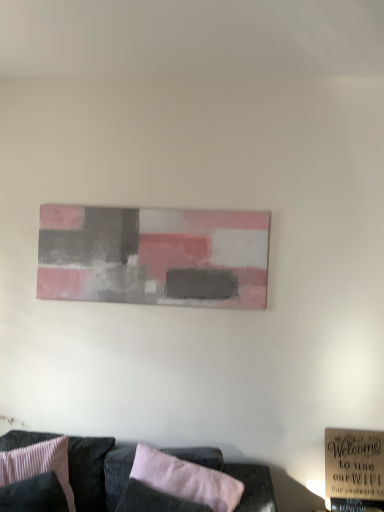
The image size is (384, 512). What do you see at coordinates (186, 479) in the screenshot? I see `pink fabric pillow at lower center, the 1th pillow viewed from the right` at bounding box center [186, 479].

What do you see at coordinates (354, 464) in the screenshot?
I see `wooden sign at lower right` at bounding box center [354, 464].

This screenshot has width=384, height=512. What are the coordinates of `pink ribbed fabric pillow at lower left, the 1th pillow when ordered from left to right` in the screenshot? It's located at (38, 464).

At what (x,y) coordinates should I click in order to perform the action: click on velvet black couch at lower center. Please return your answer as a coordinate pair (x, y). Looking at the image, I should click on (98, 472).

Locate an element on the screen. matte acrylic painting at center is located at coordinates (154, 256).

At what (x,y) coordinates should I click in order to perform the action: click on pink fabric pillow at lower center, the second pillow positioned from the left. Please return your answer as a coordinate pair (x, y). Image resolution: width=384 pixels, height=512 pixels. Looking at the image, I should click on (186, 479).

Is matte acrylic painting at center positioned far away from pink ribbed fabric pillow at lower left, the 1th pillow when ordered from left to right?

No, there isn't a large distance between matte acrylic painting at center and pink ribbed fabric pillow at lower left, the 1th pillow when ordered from left to right.

From a real-world perspective, relative to pink ribbed fabric pillow at lower left, the 1th pillow when ordered from left to right, is matte acrylic painting at center vertically above or below?

matte acrylic painting at center is above pink ribbed fabric pillow at lower left, the 1th pillow when ordered from left to right.

Can you confirm if matte acrylic painting at center is shorter than pink ribbed fabric pillow at lower left, the 1th pillow when ordered from left to right?

In fact, matte acrylic painting at center may be taller than pink ribbed fabric pillow at lower left, the 1th pillow when ordered from left to right.

Measure the distance from pink ribbed fabric pillow at lower left, the 1th pillow when ordered from left to right, to matte acrylic painting at center.

pink ribbed fabric pillow at lower left, the 1th pillow when ordered from left to right, and matte acrylic painting at center are 37.26 inches apart from each other.

Relative to matte acrylic painting at center, is pink ribbed fabric pillow at lower left, the 1th pillow when ordered from left to right, in front or behind?

Visually, pink ribbed fabric pillow at lower left, the 1th pillow when ordered from left to right, is located in front of matte acrylic painting at center.

Based on the photo, how many degrees apart are the facing directions of pink ribbed fabric pillow at lower left, which is counted as the second pillow, starting from the right, and matte acrylic painting at center?

They differ by 35.7 degrees in their facing directions.

In the scene shown: Would you say pink ribbed fabric pillow at lower left, which is counted as the second pillow, starting from the right, contains matte acrylic painting at center?

No, matte acrylic painting at center is not surrounded by pink ribbed fabric pillow at lower left, which is counted as the second pillow, starting from the right.

How many degrees apart are the facing directions of pink ribbed fabric pillow at lower left, the 1th pillow when ordered from left to right, and wooden sign at lower right?

pink ribbed fabric pillow at lower left, the 1th pillow when ordered from left to right, and wooden sign at lower right are facing 35.7 degrees away from each other.

Is pink ribbed fabric pillow at lower left, the 1th pillow when ordered from left to right, positioned with its back to wooden sign at lower right?

No, wooden sign at lower right is not at the back of pink ribbed fabric pillow at lower left, the 1th pillow when ordered from left to right.

Locate an element on the screen. This screenshot has height=512, width=384. plaque directly beneath the pink ribbed fabric pillow at lower left, which is counted as the second pillow, starting from the right (from a real-world perspective) is located at coordinates (354, 464).

Which of these two, pink ribbed fabric pillow at lower left, which is counted as the second pillow, starting from the right, or pink fabric pillow at lower center, the 1th pillow viewed from the right, is bigger?

→ pink ribbed fabric pillow at lower left, which is counted as the second pillow, starting from the right.

Where is `pillow below the pink fabric pillow at lower center, the second pillow positioned from the left (from a real-world perspective)`? Image resolution: width=384 pixels, height=512 pixels. pillow below the pink fabric pillow at lower center, the second pillow positioned from the left (from a real-world perspective) is located at coordinates (38, 464).

Considering their positions, is pink ribbed fabric pillow at lower left, which is counted as the second pillow, starting from the right, located in front of or behind pink fabric pillow at lower center, the 1th pillow viewed from the right?

Clearly, pink ribbed fabric pillow at lower left, which is counted as the second pillow, starting from the right, is behind pink fabric pillow at lower center, the 1th pillow viewed from the right.

Is pink ribbed fabric pillow at lower left, the 1th pillow when ordered from left to right, looking in the opposite direction of pink fabric pillow at lower center, the second pillow positioned from the left?

pink ribbed fabric pillow at lower left, the 1th pillow when ordered from left to right, is not turned away from pink fabric pillow at lower center, the second pillow positioned from the left.

Between point (347, 476) and point (160, 456), which one is positioned in front?

The point (160, 456) is closer.

Is wooden sign at lower right turned away from pink fabric pillow at lower center, the second pillow positioned from the left?

No, wooden sign at lower right is not facing away from pink fabric pillow at lower center, the second pillow positioned from the left.

From a real-world perspective, is wooden sign at lower right positioned under pink fabric pillow at lower center, the 1th pillow viewed from the right, based on gravity?

Yes.

In terms of size, does wooden sign at lower right appear bigger or smaller than pink fabric pillow at lower center, the 1th pillow viewed from the right?

In the image, wooden sign at lower right appears to be smaller than pink fabric pillow at lower center, the 1th pillow viewed from the right.

Is velvet black couch at lower center to the left of pink fabric pillow at lower center, the second pillow positioned from the left, from the viewer's perspective?

Yes, velvet black couch at lower center is to the left of pink fabric pillow at lower center, the second pillow positioned from the left.

Looking at this image, from a real-world perspective, is velvet black couch at lower center physically above pink fabric pillow at lower center, the second pillow positioned from the left?

No.

From the image's perspective, is velvet black couch at lower center located above pink fabric pillow at lower center, the 1th pillow viewed from the right?

No, from the image's perspective, velvet black couch at lower center is not over pink fabric pillow at lower center, the 1th pillow viewed from the right.

Can you confirm if velvet black couch at lower center is bigger than pink fabric pillow at lower center, the 1th pillow viewed from the right?

Indeed, velvet black couch at lower center has a larger size compared to pink fabric pillow at lower center, the 1th pillow viewed from the right.

Based on the photo, is pink fabric pillow at lower center, the 1th pillow viewed from the right, to the right of pink ribbed fabric pillow at lower left, which is counted as the second pillow, starting from the right, from the viewer's perspective?

Correct, you'll find pink fabric pillow at lower center, the 1th pillow viewed from the right, to the right of pink ribbed fabric pillow at lower left, which is counted as the second pillow, starting from the right.

Is pink fabric pillow at lower center, the 1th pillow viewed from the right, far away from pink ribbed fabric pillow at lower left, which is counted as the second pillow, starting from the right?

No.

Is pink fabric pillow at lower center, the second pillow positioned from the left, oriented away from pink ribbed fabric pillow at lower left, the 1th pillow when ordered from left to right?

No, pink ribbed fabric pillow at lower left, the 1th pillow when ordered from left to right, is not at the back of pink fabric pillow at lower center, the second pillow positioned from the left.

Considering the positions of objects pink fabric pillow at lower center, the second pillow positioned from the left, and pink ribbed fabric pillow at lower left, the 1th pillow when ordered from left to right, in the image provided, who is behind, pink fabric pillow at lower center, the second pillow positioned from the left, or pink ribbed fabric pillow at lower left, the 1th pillow when ordered from left to right,?

pink ribbed fabric pillow at lower left, the 1th pillow when ordered from left to right, is behind.

At what (x,y) coordinates should I click in order to perform the action: click on picture frame lying on the right of pink ribbed fabric pillow at lower left, which is counted as the second pillow, starting from the right. Please return your answer as a coordinate pair (x, y). Looking at the image, I should click on (154, 256).

Starting from the matte acrylic painting at center, which pillow is the 1st one in front? Please provide its 2D coordinates.

[(38, 464)]

Considering their positions, is velvet black couch at lower center positioned closer to pink ribbed fabric pillow at lower left, which is counted as the second pillow, starting from the right, than wooden sign at lower right?

velvet black couch at lower center is positioned closer to the anchor pink ribbed fabric pillow at lower left, which is counted as the second pillow, starting from the right.

Looking at this image, estimate the real-world distances between objects in this image. Which object is closer to matte acrylic painting at center, pink ribbed fabric pillow at lower left, the 1th pillow when ordered from left to right, or wooden sign at lower right?

Based on the image, pink ribbed fabric pillow at lower left, the 1th pillow when ordered from left to right, appears to be nearer to matte acrylic painting at center.

Estimate the real-world distances between objects in this image. Which object is further from pink fabric pillow at lower center, the 1th pillow viewed from the right, velvet black couch at lower center or matte acrylic painting at center?

The object further to pink fabric pillow at lower center, the 1th pillow viewed from the right, is matte acrylic painting at center.

Estimate the real-world distances between objects in this image. Which object is closer to pink ribbed fabric pillow at lower left, the 1th pillow when ordered from left to right, wooden sign at lower right or velvet black couch at lower center?

Among the two, velvet black couch at lower center is located nearer to pink ribbed fabric pillow at lower left, the 1th pillow when ordered from left to right.

When comparing their distances from matte acrylic painting at center, does pink fabric pillow at lower center, the second pillow positioned from the left, or wooden sign at lower right seem closer?

Among the two, pink fabric pillow at lower center, the second pillow positioned from the left, is located nearer to matte acrylic painting at center.

From the image, which object appears to be nearer to velvet black couch at lower center, pink ribbed fabric pillow at lower left, which is counted as the second pillow, starting from the right, or matte acrylic painting at center?

Among the two, pink ribbed fabric pillow at lower left, which is counted as the second pillow, starting from the right, is located nearer to velvet black couch at lower center.

When comparing their distances from wooden sign at lower right, does matte acrylic painting at center or pink fabric pillow at lower center, the 1th pillow viewed from the right, seem further?

matte acrylic painting at center lies further to wooden sign at lower right than the other object.

When comparing their distances from velvet black couch at lower center, does matte acrylic painting at center or pink fabric pillow at lower center, the 1th pillow viewed from the right, seem further?

matte acrylic painting at center is positioned further to the anchor velvet black couch at lower center.

Image resolution: width=384 pixels, height=512 pixels. Identify the location of pillow located between pink ribbed fabric pillow at lower left, the 1th pillow when ordered from left to right, and wooden sign at lower right in the left-right direction. (186, 479).

At what (x,y) coordinates should I click in order to perform the action: click on studio couch situated between pink ribbed fabric pillow at lower left, which is counted as the second pillow, starting from the right, and wooden sign at lower right from left to right. Please return your answer as a coordinate pair (x, y). This screenshot has width=384, height=512. Looking at the image, I should click on pyautogui.click(x=98, y=472).

I want to click on picture frame between pink ribbed fabric pillow at lower left, the 1th pillow when ordered from left to right, and wooden sign at lower right, so [154, 256].

The width and height of the screenshot is (384, 512). I want to click on plaque between matte acrylic painting at center and velvet black couch at lower center vertically, so click(x=354, y=464).